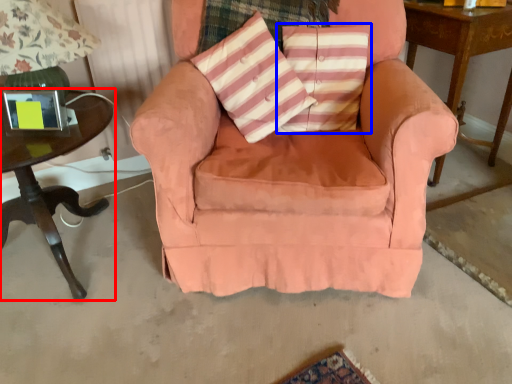
Question: Among these objects, which one is farthest to the camera, table (highlighted by a red box) or pillow (highlighted by a blue box)?

Choices:
 (A) table
 (B) pillow

Answer: (B)